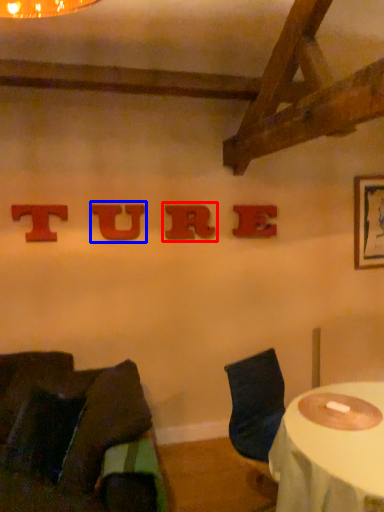
Question: Which of the following is the closest to the observer, alphabet (highlighted by a red box) or alphabet (highlighted by a blue box)?

Choices:
 (A) alphabet
 (B) alphabet

Answer: (B)